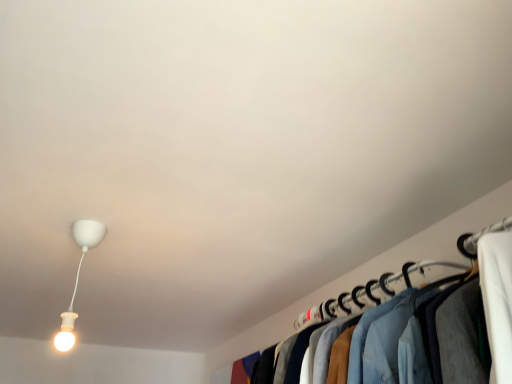
This screenshot has width=512, height=384. What do you see at coordinates (487, 232) in the screenshot? I see `denim jacket at right` at bounding box center [487, 232].

Find the location of `denim jacket at right`. denim jacket at right is located at coordinates (487, 232).

Image resolution: width=512 pixels, height=384 pixels. Describe the element at coordinates (78, 277) in the screenshot. I see `white matte lamp at upper left` at that location.

Measure the distance between white matte lamp at upper left and camera.

white matte lamp at upper left and camera are 5.29 feet apart from each other.

The height and width of the screenshot is (384, 512). Find the location of `white matte lamp at upper left`. white matte lamp at upper left is located at coordinates (78, 277).

Find the location of a particular element. denim jacket at right is located at coordinates (487, 232).

Is denim jacket at right at the right side of white matte lamp at upper left?

Indeed, denim jacket at right is positioned on the right side of white matte lamp at upper left.

Between denim jacket at right and white matte lamp at upper left, which one is positioned in front?

denim jacket at right is in front.

Does point (303, 313) appear closer or farther from the camera than point (69, 313)?

Clearly, point (303, 313) is more distant from the camera than point (69, 313).

From the image's perspective, would you say denim jacket at right is positioned over white matte lamp at upper left?

No, from the image's perspective, denim jacket at right is not on top of white matte lamp at upper left.

From a real-world perspective, does denim jacket at right sit lower than white matte lamp at upper left?

Indeed, from a real-world perspective, denim jacket at right is positioned beneath white matte lamp at upper left.

Is denim jacket at right wider or thinner than white matte lamp at upper left?

denim jacket at right is wider than white matte lamp at upper left.

Who is taller, denim jacket at right or white matte lamp at upper left?

white matte lamp at upper left.

Based on the photo, is denim jacket at right bigger or smaller than white matte lamp at upper left?

A: Clearly, denim jacket at right is larger in size than white matte lamp at upper left.

Choose the correct answer: Is denim jacket at right inside white matte lamp at upper left or outside it?

denim jacket at right is not enclosed by white matte lamp at upper left.

Would you say denim jacket at right is a long distance from white matte lamp at upper left?

Indeed, denim jacket at right is not near white matte lamp at upper left.

Is denim jacket at right facing towards white matte lamp at upper left?

Yes, denim jacket at right is turned towards white matte lamp at upper left.

Identify the location of lamp behind the denim jacket at right. Image resolution: width=512 pixels, height=384 pixels. (78, 277).

Based on their positions, is white matte lamp at upper left located to the left or right of denim jacket at right?

white matte lamp at upper left is positioned on denim jacket at right's left side.

Which object is closer to the camera, white matte lamp at upper left or denim jacket at right?

denim jacket at right is in front.

Is point (84, 236) closer to camera compared to point (311, 324)?

Yes, it is.

From the image's perspective, which one is positioned lower, white matte lamp at upper left or denim jacket at right?

denim jacket at right.

From a real-world perspective, is white matte lamp at upper left above or below denim jacket at right?

In terms of real-world spatial position, white matte lamp at upper left is above denim jacket at right.

From the picture: In terms of width, does white matte lamp at upper left look wider or thinner when compared to denim jacket at right?

Considering their sizes, white matte lamp at upper left looks slimmer than denim jacket at right.

Is white matte lamp at upper left taller or shorter than denim jacket at right?

In the image, white matte lamp at upper left appears to be taller than denim jacket at right.

Who is bigger, white matte lamp at upper left or denim jacket at right?

denim jacket at right is bigger.

Is denim jacket at right surrounded by white matte lamp at upper left?

No, denim jacket at right is not inside white matte lamp at upper left.

Is white matte lamp at upper left next to denim jacket at right and touching it?

No, white matte lamp at upper left is not touching denim jacket at right.

Could you tell me if white matte lamp at upper left is facing denim jacket at right?

No, white matte lamp at upper left is not turned towards denim jacket at right.

How distant is white matte lamp at upper left from denim jacket at right?

3.53 feet.

This screenshot has width=512, height=384. What are the coordinates of `closet on the right of white matte lamp at upper left` in the screenshot? It's located at (487, 232).

Image resolution: width=512 pixels, height=384 pixels. Identify the location of lamp positioned vertically above the denim jacket at right (from a real-world perspective). (78, 277).

This screenshot has width=512, height=384. Identify the location of lamp above the denim jacket at right (from the image's perspective). point(78,277).